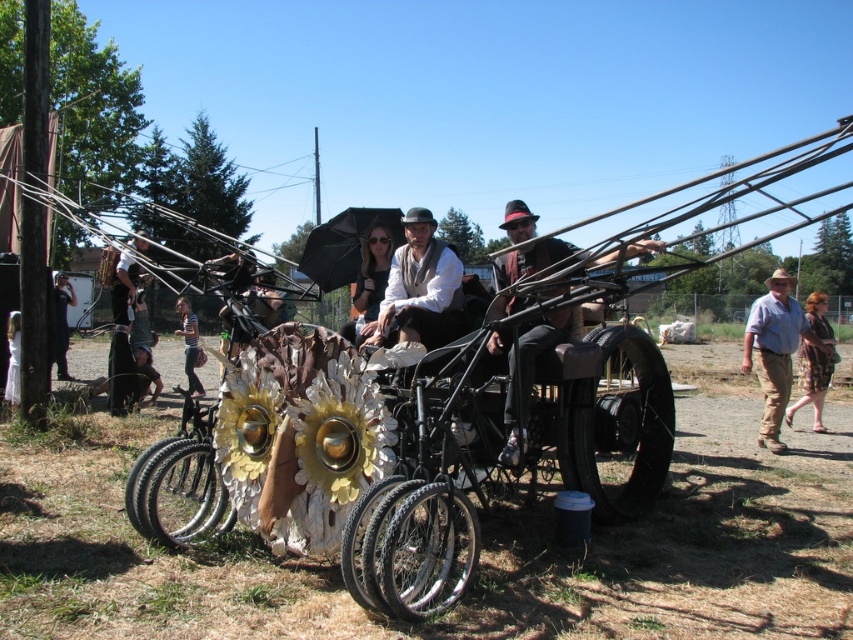
You are a photographer trying to capture the scene of the vintage carriage. You want to ensure both the matte white hat at center and the plaid skirt at right are clearly visible in your photo. Based on their sizes, which object should you focus on first to ensure it stands out more in the composition?

The plaid skirt at right occupies more space than the matte white hat at center, so focusing on the plaid skirt at right first will ensure it stands out more in the composition.

You are a photographer standing behind the carriage and want to take a photo of both the matte white hat at center and the plaid skirt at right. Can you see both objects clearly in your current position?

The matte white hat at center is in front of the plaid skirt at right, so the photographer standing behind the carriage might have the hat blocking the view of the skirt in the photo.